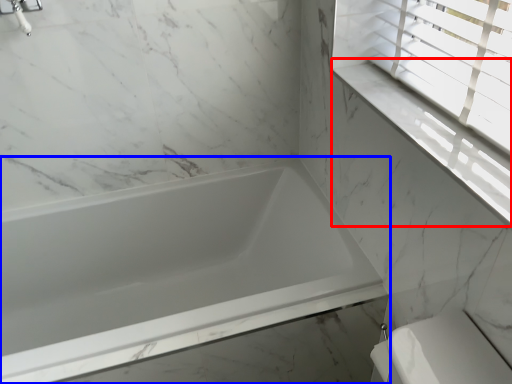
Question: Which of the following is the closest to the observer, window sill (highlighted by a red box) or bathtub (highlighted by a blue box)?

Choices:
 (A) window sill
 (B) bathtub

Answer: (A)